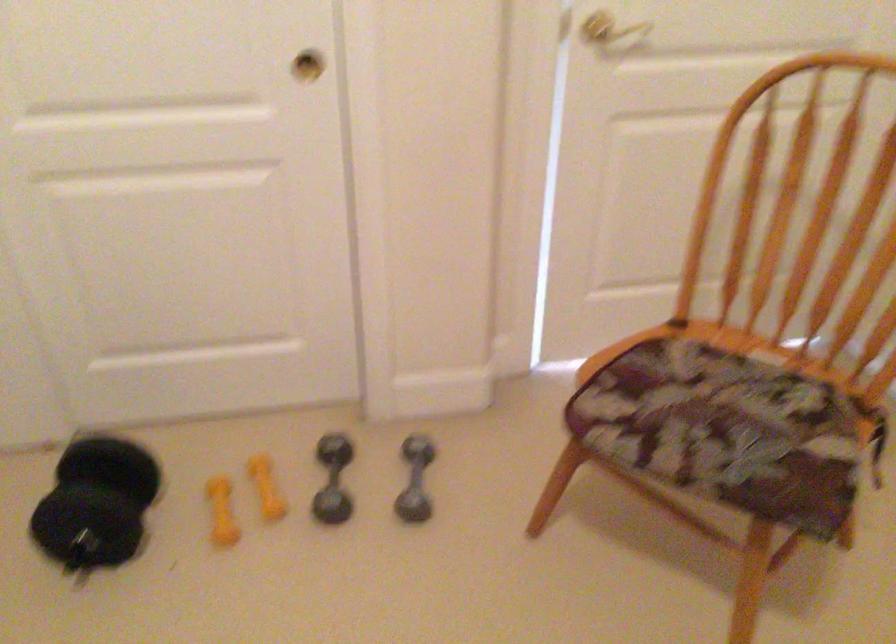
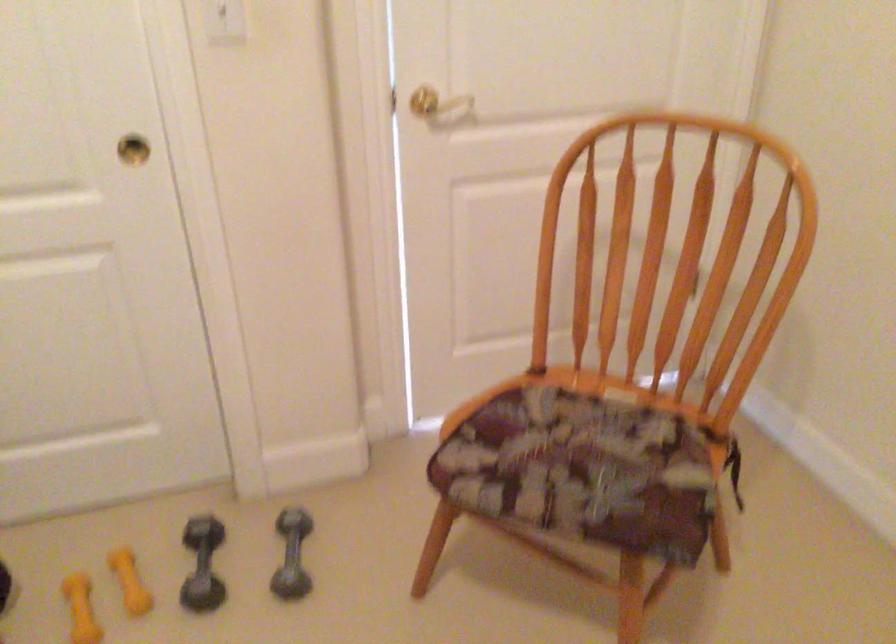
The point at (x=227, y=504) is marked in the first image. Where is the corresponding point in the second image?

(81, 609)